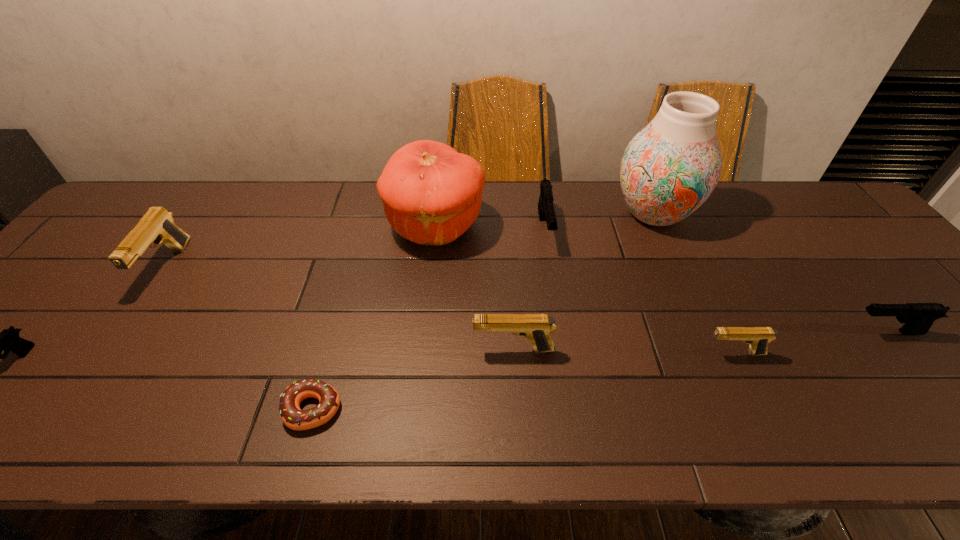
In order to click on unoccupied area between the second tan pistol from left to right and the second biggest black pistol in this screenshot , I will do (700, 341).

Where is `free space that is in between the biggest black pistol and the rightmost object`? free space that is in between the biggest black pistol and the rightmost object is located at coordinates pos(715,281).

What are the coordinates of `vacant space that is in between the eighth shortest object and the rightmost tan pistol` in the screenshot? It's located at (585, 290).

At what (x,y) coordinates should I click in order to perform the action: click on vacant space that is in between the doughnut and the pumpkin. Please return your answer as a coordinate pair (x, y). Looking at the image, I should click on (374, 318).

Where is `free space between the shortest object and the smallest tan pistol`? This screenshot has height=540, width=960. free space between the shortest object and the smallest tan pistol is located at coordinates (523, 381).

Point out which object is positioned as the fourth nearest to the smallest black pistol. Please provide its 2D coordinates. Your answer should be formatted as a tuple, i.e. [(x, y)], where the tuple contains the x and y coordinates of a point satisfying the conditions above.

[(536, 327)]

Identify which object is the sixth nearest to the rightmost tan pistol. Please provide its 2D coordinates. Your answer should be formatted as a tuple, i.e. [(x, y)], where the tuple contains the x and y coordinates of a point satisfying the conditions above.

[(293, 417)]

At what (x,y) coordinates should I click in order to perform the action: click on pistol that is the fifth nearest to the doughnut. Please return your answer as a coordinate pair (x, y). Looking at the image, I should click on (758, 337).

Locate which pistol ranks in proximity to the eighth object from right to left. Please provide its 2D coordinates. Your answer should be formatted as a tuple, i.e. [(x, y)], where the tuple contains the x and y coordinates of a point satisfying the conditions above.

[(8, 340)]

Point out which tan pistol is positioned as the second nearest to the fifth pistol from left to right. Please provide its 2D coordinates. Your answer should be formatted as a tuple, i.e. [(x, y)], where the tuple contains the x and y coordinates of a point satisfying the conditions above.

[(157, 225)]